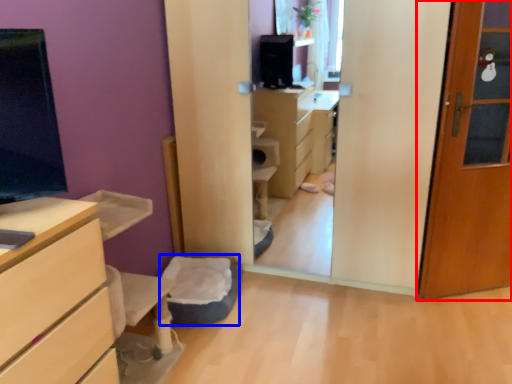
Question: Which object is closer to the camera taking this photo, door (highlighted by a red box) or flat (highlighted by a blue box)?

Choices:
 (A) door
 (B) flat

Answer: (A)